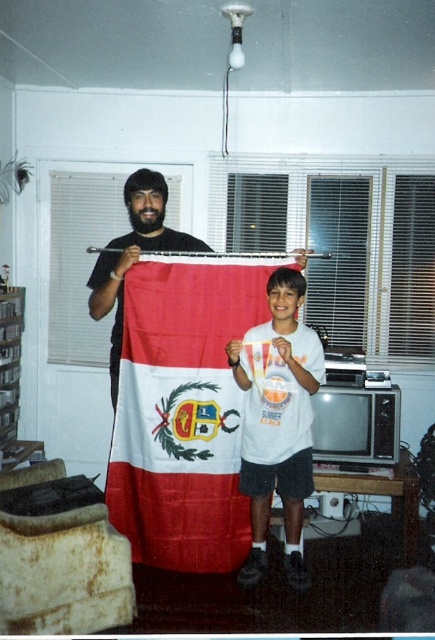
Between point (297, 579) and point (153, 177), which one is positioned behind?

The point (153, 177) is behind.

Which is in front, point (284, 392) or point (150, 208)?

Point (284, 392) is in front.

Who is more forward, (290, 490) or (143, 228)?

Positioned in front is point (290, 490).

Locate an element on the screen. Image resolution: width=435 pixels, height=640 pixels. white cotton t-shirt at center is located at coordinates (277, 420).

Is point (234, 308) closer to viewer compared to point (160, 188)?

No, it is not.

The height and width of the screenshot is (640, 435). Describe the element at coordinates (184, 410) in the screenshot. I see `red and white fabric flag at center` at that location.

Is point (254, 320) positioned before point (201, 246)?

Yes, point (254, 320) is closer to viewer.

Locate an element on the screen. red and white fabric flag at center is located at coordinates (184, 410).

Is red and white fabric flag at center bigger than white cotton t-shirt at center?

No, red and white fabric flag at center is not bigger than white cotton t-shirt at center.

Who is taller, red and white fabric flag at center or white cotton t-shirt at center?

red and white fabric flag at center is taller.

Between point (187, 284) and point (270, 380), which one is positioned behind?

The point (187, 284) is behind.

What are the coordinates of `red and white fabric flag at center` in the screenshot? It's located at (184, 410).